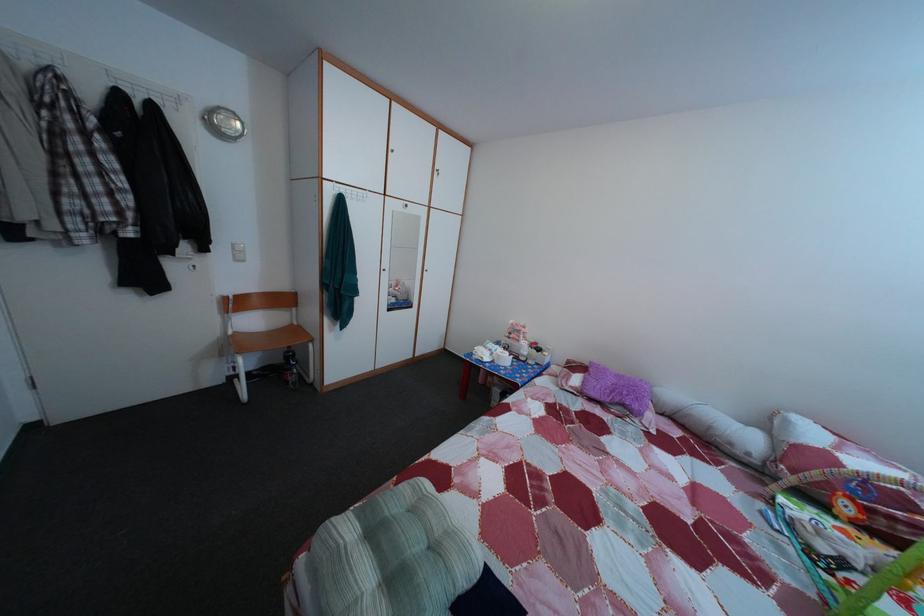
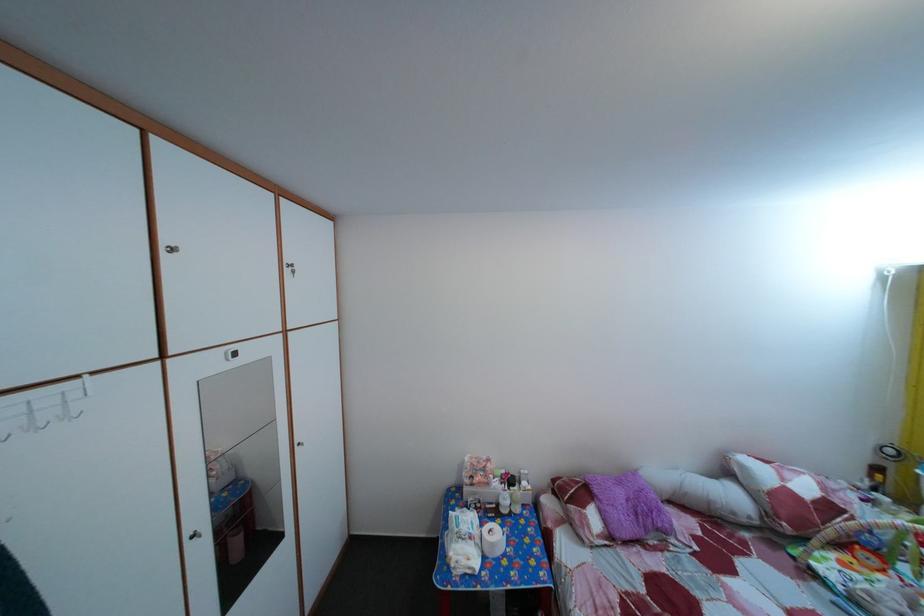
Find the pixel in the second image that matches pixel 628 384 in the first image.

(629, 491)